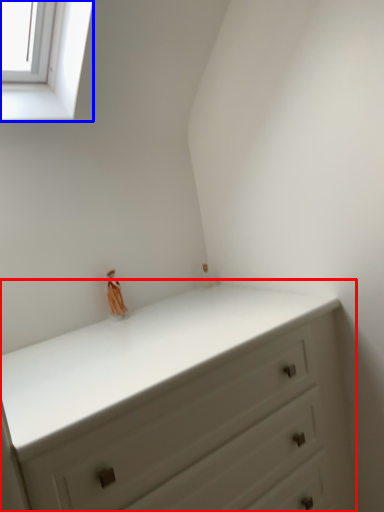
Question: Which object is closer to the camera taking this photo, chest of drawers (highlighted by a red box) or window (highlighted by a blue box)?

Choices:
 (A) chest of drawers
 (B) window

Answer: (A)